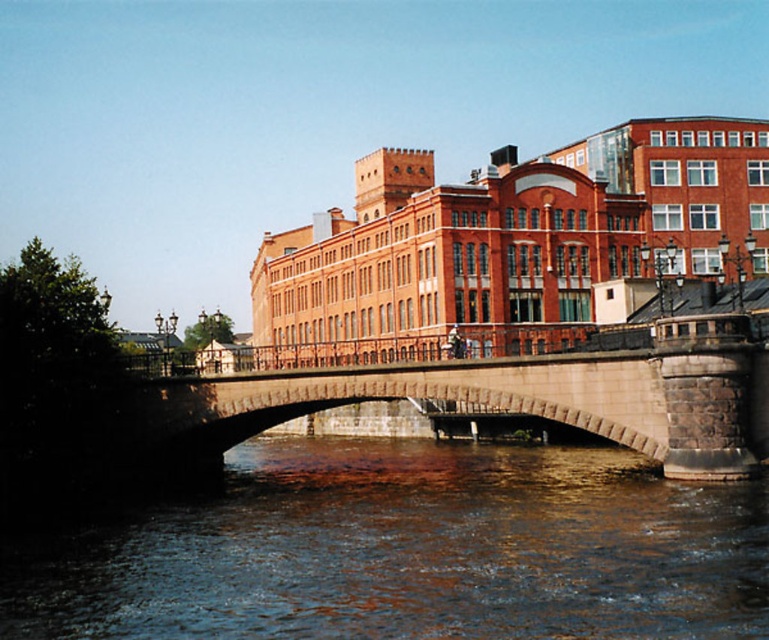
Can you confirm if brown stone water at center is positioned below stone bridge at center?

Indeed, brown stone water at center is positioned under stone bridge at center.

Is point (95, 563) closer to viewer compared to point (524, 394)?

Yes, point (95, 563) is in front of point (524, 394).

Is point (431, 506) positioned before point (656, 449)?

That is False.

Where is `brown stone water at center`? This screenshot has height=640, width=769. brown stone water at center is located at coordinates point(408,550).